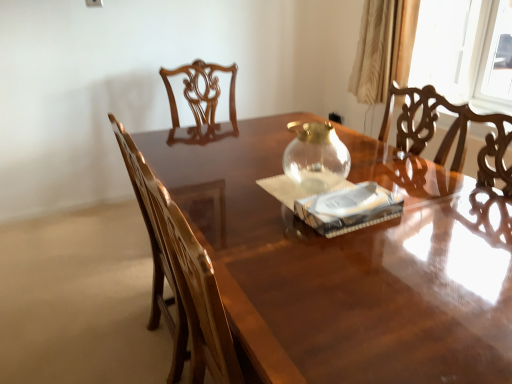
Question: Is point (474, 311) closer or farther from the camera than point (181, 271)?

Choices:
 (A) closer
 (B) farther

Answer: (A)

Question: From a real-world perspective, relative to glossy wood chair at left, is glossy wood table at center vertically above or below?

Choices:
 (A) below
 (B) above

Answer: (A)

Question: Which is farther from the glossy wood chair at left?

Choices:
 (A) white paper at center
 (B) beige satin curtain at upper right
 (C) glossy wood table at center
 (D) transparent glass teapot at center

Answer: (B)

Question: Which of these objects is positioned closest to the beige satin curtain at upper right?

Choices:
 (A) glossy wood chair at left
 (B) glossy wood table at center
 (C) transparent glass teapot at center
 (D) white paper at center

Answer: (C)